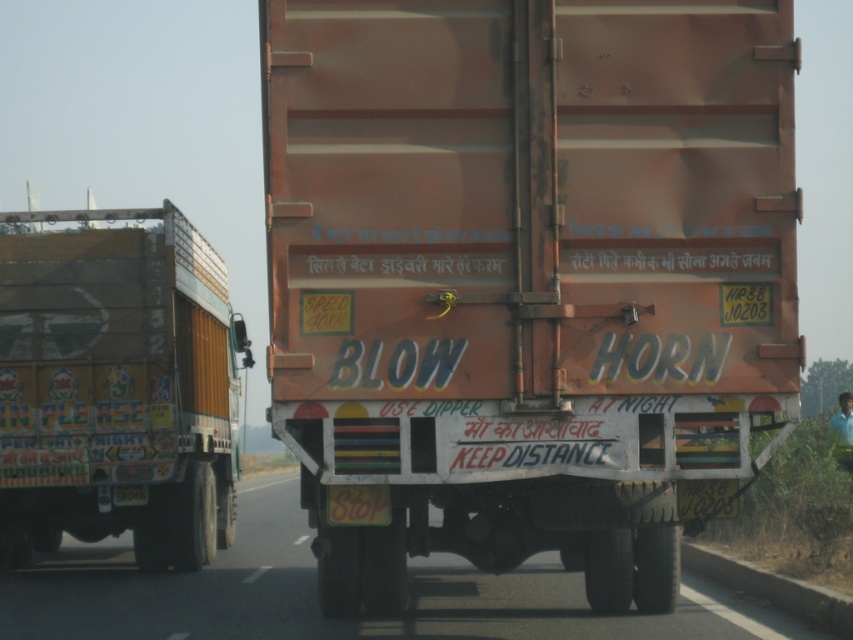
You are a delivery driver who needs to park your painted wooden truck at left in a parking spot that is 1.2 meters wide. Based on the scene, can you determine if the truck will fit in the parking spot?

The painted wooden truck at left is located at point (117, 387), which likely indicates its dimensions relative to the image. However, without specific measurements of the truck itself, we cannot confirm if it will fit in the 1.2 meter wide parking spot. More information about the truck dimensions is needed.

You are a delivery driver observing the orange matte trailer truck at center and the painted wooden truck at left on the road. Which truck is taller?

The orange matte trailer truck at center is taller than the painted wooden truck at left.

Based on the photo, you are driving a car and see the orange matte trailer truck at center and the orange matte truck at center on the road. Which one is positioned to the right side of the other?

The orange matte trailer truck at center is positioned to the right of the orange matte truck at center.